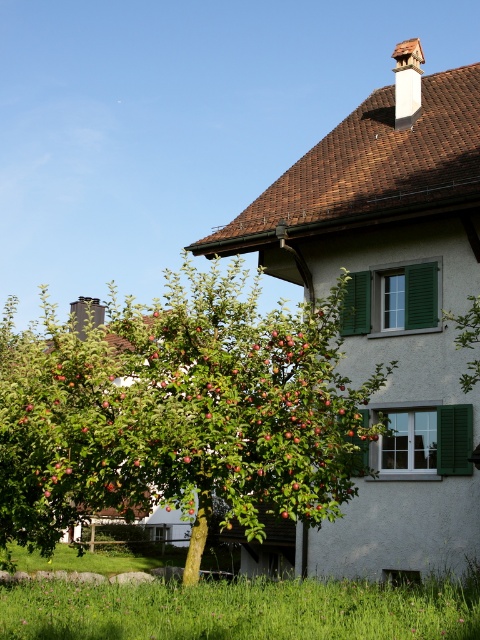
Which is in front, point (34, 522) or point (417, 632)?

Point (417, 632) is in front.

Between point (44, 497) and point (136, 611), which one is positioned behind?

The point (44, 497) is behind.

Is point (201, 484) in front of point (330, 593)?

No, (201, 484) is further to viewer.

Where is `green leafy tree at center`? This screenshot has width=480, height=640. green leafy tree at center is located at coordinates click(x=180, y=412).